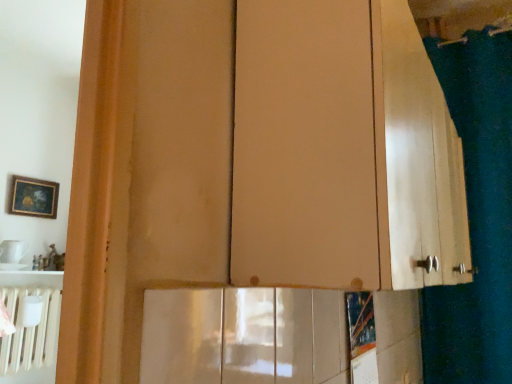
Question: Is matte wood cabinet at center situated inside green fabric shower curtain at right or outside?

Choices:
 (A) outside
 (B) inside

Answer: (A)

Question: In the image, is matte wood cabinet at center on the left side or the right side of green fabric shower curtain at right?

Choices:
 (A) right
 (B) left

Answer: (B)

Question: From a real-world perspective, is matte wood cabinet at center positioned above or below green fabric shower curtain at right?

Choices:
 (A) below
 (B) above

Answer: (A)

Question: In terms of width, does green fabric shower curtain at right look wider or thinner when compared to matte wood cabinet at center?

Choices:
 (A) wide
 (B) thin

Answer: (B)

Question: Considering the positions of green fabric shower curtain at right and matte wood cabinet at center in the image, is green fabric shower curtain at right taller or shorter than matte wood cabinet at center?

Choices:
 (A) short
 (B) tall

Answer: (B)

Question: From the image's perspective, relative to matte wood cabinet at center, is green fabric shower curtain at right above or below?

Choices:
 (A) above
 (B) below

Answer: (B)

Question: Looking at the image, does green fabric shower curtain at right seem bigger or smaller compared to matte wood cabinet at center?

Choices:
 (A) big
 (B) small

Answer: (B)